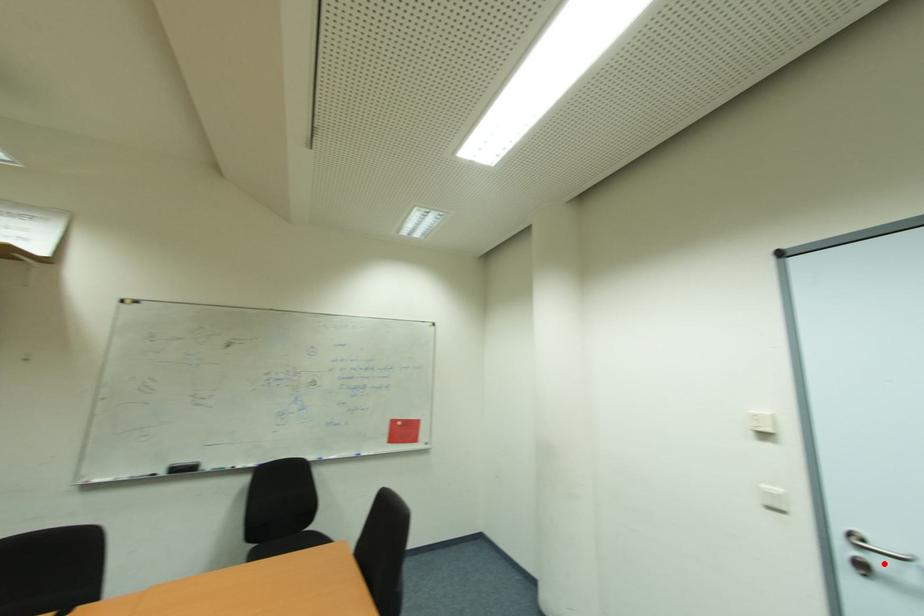
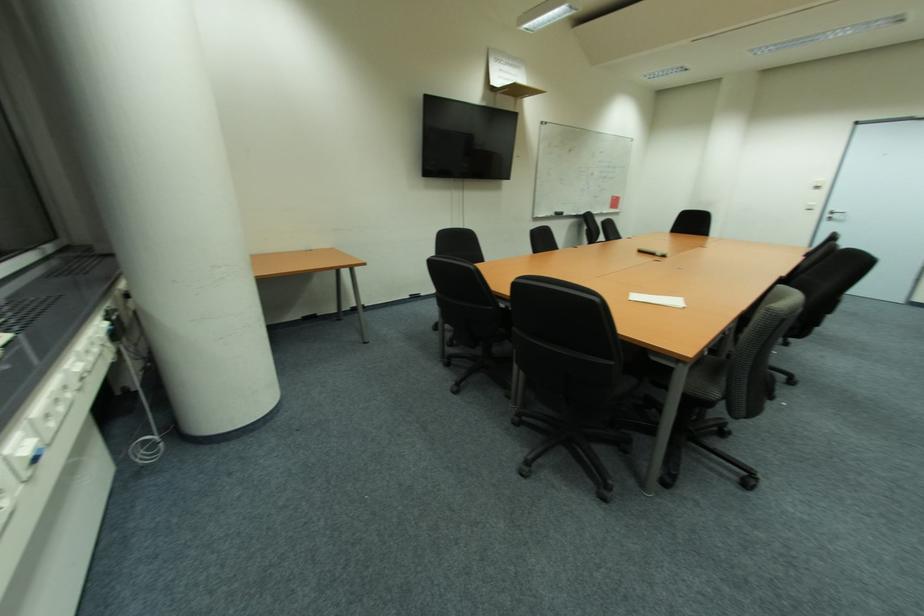
Question: I am providing you with two images of the same scene from different viewpoints. Given a red point in image1, look at the same physical point in image2. Is it:

Choices:
 (A) Closer to the viewpoint
 (B) Farther from the viewpoint

Answer: (B)